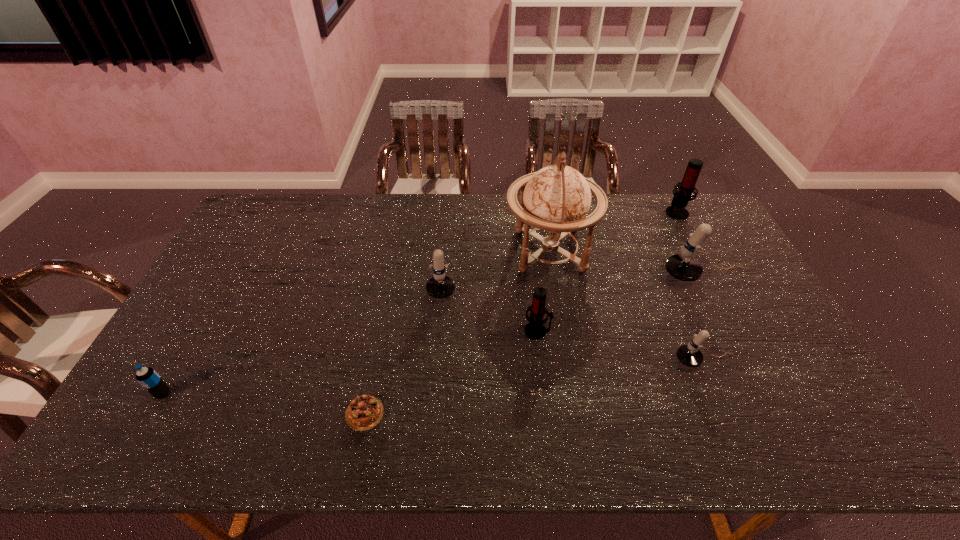
Find the location of `vacant space that's between the biggest white microphone and the shortest object`. vacant space that's between the biggest white microphone and the shortest object is located at coordinates (535, 345).

The width and height of the screenshot is (960, 540). I want to click on unoccupied position between the leftmost object and the second biggest white microphone, so click(302, 336).

Identify the location of the fifth closest object to the nearer red microphone. (684, 267).

Select which object is the fourth closest to the globe. Please provide its 2D coordinates. Your answer should be formatted as a tuple, i.e. [(x, y)], where the tuple contains the x and y coordinates of a point satisfying the conditions above.

[(690, 355)]

The width and height of the screenshot is (960, 540). Identify the location of microphone that is the third closest to the smaller red microphone. pyautogui.click(x=684, y=267).

Find the location of a particular element. Image resolution: width=960 pixels, height=540 pixels. microphone that stands as the closest to the farthest object is located at coordinates (684, 267).

At what (x,y) coordinates should I click in order to perform the action: click on the closest white microphone to the sixth farthest object. Please return your answer as a coordinate pair (x, y). The height and width of the screenshot is (540, 960). Looking at the image, I should click on [x=684, y=267].

Point out which white microphone is positioned as the nearest to the soda bottle. Please provide its 2D coordinates. Your answer should be formatted as a tuple, i.e. [(x, y)], where the tuple contains the x and y coordinates of a point satisfying the conditions above.

[(440, 286)]

Find the location of a particular element. free spot that satisfies the following two spatial constraints: 1. on the back side of the smallest white microphone; 2. on the left side of the seventh object from right to left is located at coordinates (375, 360).